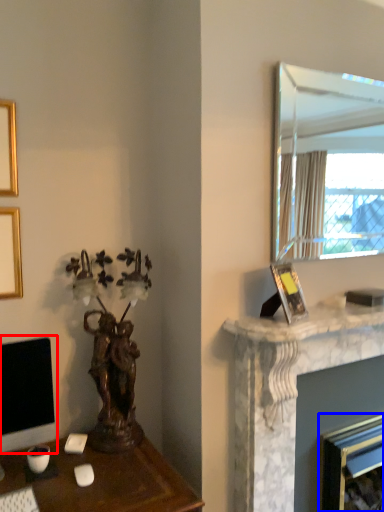
Question: Which object appears closest to the camera in this image, computer monitor (highlighted by a red box) or fireplace (highlighted by a blue box)?

Choices:
 (A) computer monitor
 (B) fireplace

Answer: (A)